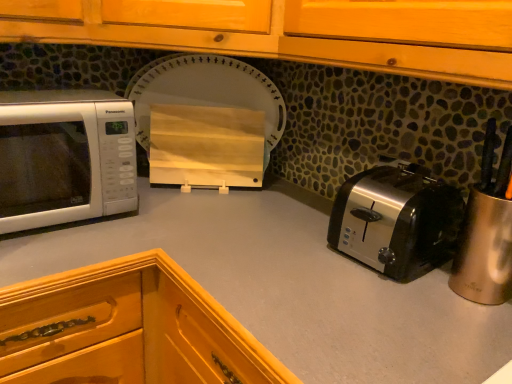
In order to click on smooth gray countertop at center in this screenshot , I will do `click(291, 285)`.

What do you see at coordinates (65, 157) in the screenshot? I see `white glossy microwave at left` at bounding box center [65, 157].

Find the location of `smooth gray countertop at center`. smooth gray countertop at center is located at coordinates (291, 285).

Is white glossy microwave at left looking in the opposite direction of satin silver toaster at lower right?

No.

Is white glossy microwave at left positioned beyond the bounds of satin silver toaster at lower right?

white glossy microwave at left is positioned outside satin silver toaster at lower right.

Is white glossy microwave at left next to satin silver toaster at lower right?

white glossy microwave at left and satin silver toaster at lower right are clearly separated.

In the scene shown: What's the angular difference between white glossy microwave at left and satin silver toaster at lower right's facing directions?

The angle between the facing direction of white glossy microwave at left and the facing direction of satin silver toaster at lower right is 86.4 degrees.

Is wooden cutting board at center touching smooth gray countertop at center?

They are not placed beside each other.

From the picture: Which is closer, (226, 99) or (319, 266)?

The point (319, 266) is more forward.

Between wooden cutting board at center and smooth gray countertop at center, which one has smaller width?

Thinner between the two is wooden cutting board at center.

Is wooden cutting board at center bigger or smaller than smooth gray countertop at center?

wooden cutting board at center is smaller than smooth gray countertop at center.

How much distance is there between wooden cutting board at center and satin silver toaster at lower right?

22.39 inches.

Is wooden cutting board at center not near satin silver toaster at lower right?

No, wooden cutting board at center is not far from satin silver toaster at lower right.

From the image's perspective, which one is positioned higher, wooden cutting board at center or satin silver toaster at lower right?

wooden cutting board at center is shown above in the image.

Which of these two, wooden cutting board at center or satin silver toaster at lower right, is thinner?

wooden cutting board at center is thinner.

Does point (123, 236) appear closer or farther from the camera than point (412, 243)?

Point (123, 236) is farther from the camera than point (412, 243).

Is smooth gray countertop at center completely or partially outside of satin silver toaster at lower right?

Yes, smooth gray countertop at center is not within satin silver toaster at lower right.

Is smooth gray countertop at center at the right side of satin silver toaster at lower right?

No, smooth gray countertop at center is not to the right of satin silver toaster at lower right.

The height and width of the screenshot is (384, 512). What are the coordinates of `countertop below the satin silver toaster at lower right (from a real-world perspective)` in the screenshot? It's located at (291, 285).

Considering the sizes of objects satin silver toaster at lower right and wooden cutting board at center in the image provided, who is shorter, satin silver toaster at lower right or wooden cutting board at center?

satin silver toaster at lower right is shorter.

Is satin silver toaster at lower right inside the boundaries of wooden cutting board at center, or outside?

satin silver toaster at lower right is not enclosed by wooden cutting board at center.

Locate an element on the screen. The image size is (512, 384). toaster that appears below the wooden cutting board at center (from the image's perspective) is located at coordinates (396, 221).

Who is smaller, satin silver toaster at lower right or wooden cutting board at center?

Smaller between the two is satin silver toaster at lower right.

Considering the relative positions of smooth gray countertop at center and wooden cutting board at center in the image provided, is smooth gray countertop at center behind wooden cutting board at center?

No, the depth of smooth gray countertop at center is less than that of wooden cutting board at center.

The width and height of the screenshot is (512, 384). Find the location of `appliance lying behind the smooth gray countertop at center`. appliance lying behind the smooth gray countertop at center is located at coordinates (211, 106).

In the scene shown: Is smooth gray countertop at center positioned far away from wooden cutting board at center?

No, smooth gray countertop at center is in close proximity to wooden cutting board at center.

In the scene shown: Is smooth gray countertop at center situated inside wooden cutting board at center or outside?

smooth gray countertop at center is not enclosed by wooden cutting board at center.

Which of these two, satin silver toaster at lower right or white glossy microwave at left, is thinner?

With smaller width is satin silver toaster at lower right.

Is satin silver toaster at lower right touching white glossy microwave at left?

No, satin silver toaster at lower right is not beside white glossy microwave at left.

Which object is closer to the camera taking this photo, satin silver toaster at lower right or white glossy microwave at left?

satin silver toaster at lower right.

Locate an element on the screen. The width and height of the screenshot is (512, 384). microwave oven that is above the satin silver toaster at lower right (from a real-world perspective) is located at coordinates (65, 157).

The width and height of the screenshot is (512, 384). What are the coordinates of `appliance above the smooth gray countertop at center (from the image's perspective)` in the screenshot? It's located at (211, 106).

Which object lies nearer to the anchor point white glossy microwave at left, wooden cutting board at center or smooth gray countertop at center?

smooth gray countertop at center lies closer to white glossy microwave at left than the other object.

Estimate the real-world distances between objects in this image. Which object is further from satin silver toaster at lower right, wooden cutting board at center or smooth gray countertop at center?

wooden cutting board at center lies further to satin silver toaster at lower right than the other object.

Based on their spatial positions, is satin silver toaster at lower right or wooden cutting board at center further from smooth gray countertop at center?

The object further to smooth gray countertop at center is wooden cutting board at center.

When comparing their distances from wooden cutting board at center, does white glossy microwave at left or satin silver toaster at lower right seem further?

satin silver toaster at lower right is further to wooden cutting board at center.

From the image, which object appears to be nearer to wooden cutting board at center, satin silver toaster at lower right or smooth gray countertop at center?

The object closer to wooden cutting board at center is smooth gray countertop at center.

Which object lies nearer to the anchor point satin silver toaster at lower right, white glossy microwave at left or smooth gray countertop at center?

smooth gray countertop at center lies closer to satin silver toaster at lower right than the other object.

Based on their spatial positions, is smooth gray countertop at center or wooden cutting board at center further from satin silver toaster at lower right?

wooden cutting board at center is positioned further to the anchor satin silver toaster at lower right.

Considering their positions, is wooden cutting board at center positioned further to smooth gray countertop at center than white glossy microwave at left?

Among the two, wooden cutting board at center is located further to smooth gray countertop at center.

Where is `appliance between white glossy microwave at left and satin silver toaster at lower right in the horizontal direction`? appliance between white glossy microwave at left and satin silver toaster at lower right in the horizontal direction is located at coordinates (211, 106).

I want to click on toaster between wooden cutting board at center and smooth gray countertop at center in the up-down direction, so click(x=396, y=221).

The height and width of the screenshot is (384, 512). Find the location of `microwave oven between wooden cutting board at center and smooth gray countertop at center in the up-down direction`. microwave oven between wooden cutting board at center and smooth gray countertop at center in the up-down direction is located at coordinates (65, 157).

The image size is (512, 384). I want to click on countertop between white glossy microwave at left and satin silver toaster at lower right, so click(291, 285).